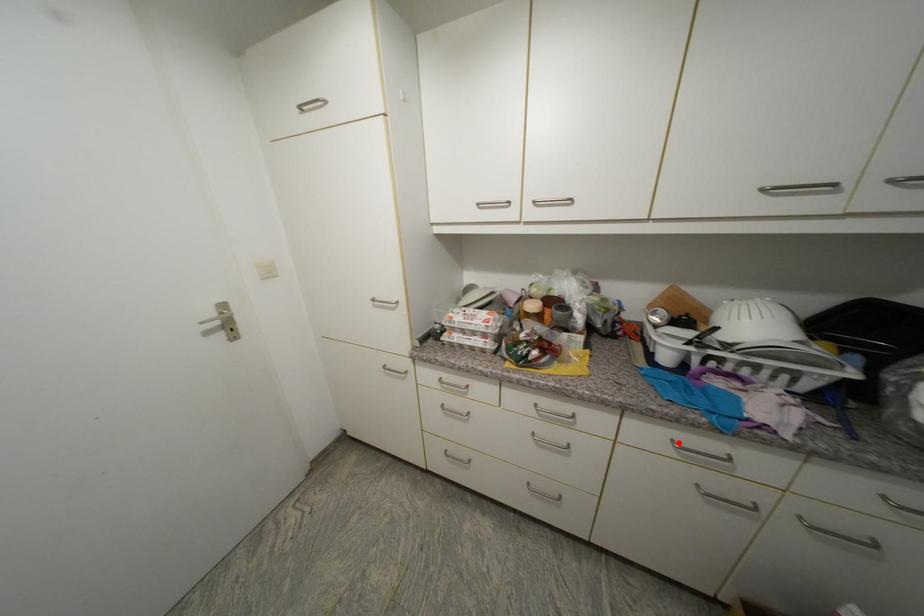
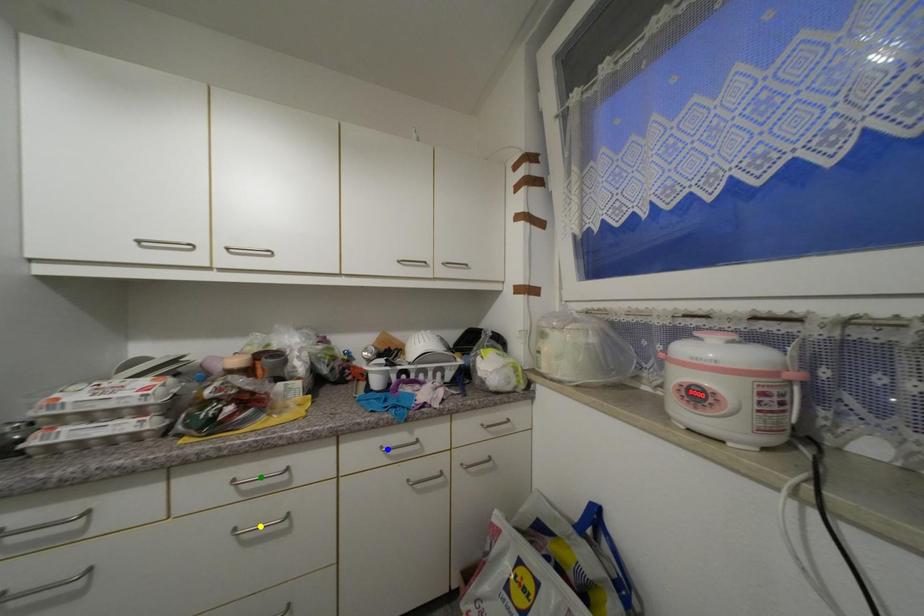
Question: I am providing you with two images of the same scene from different viewpoints. A red point is marked on the first image. You are given multiple points on the second image. In image 2, which mark is for the same physical point as the one in image 1?

Choices:
 (A) blue point
 (B) green point
 (C) yellow point

Answer: (A)